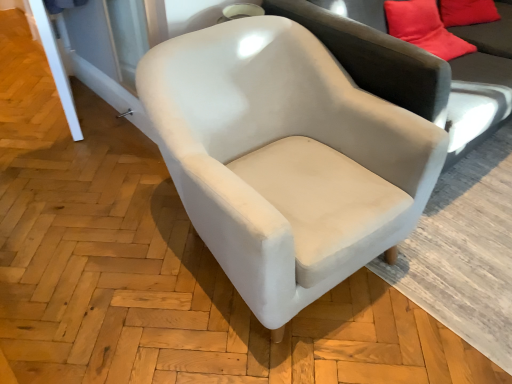
Question: From their relative heights in the image, would you say suede-like beige couch at center is taller or shorter than white velvet chair at center?

Choices:
 (A) short
 (B) tall

Answer: (B)

Question: In terms of size, does suede-like beige couch at center appear bigger or smaller than white velvet chair at center?

Choices:
 (A) big
 (B) small

Answer: (A)

Question: Considering the relative positions of suede-like beige couch at center and white velvet chair at center in the image provided, is suede-like beige couch at center to the left or to the right of white velvet chair at center?

Choices:
 (A) right
 (B) left

Answer: (A)

Question: Does point (262, 155) appear closer or farther from the camera than point (423, 59)?

Choices:
 (A) closer
 (B) farther

Answer: (B)

Question: Considering the positions of white velvet chair at center and suede-like beige couch at center in the image, is white velvet chair at center wider or thinner than suede-like beige couch at center?

Choices:
 (A) thin
 (B) wide

Answer: (A)

Question: From the image's perspective, is white velvet chair at center above or below suede-like beige couch at center?

Choices:
 (A) above
 (B) below

Answer: (B)

Question: In terms of size, does white velvet chair at center appear bigger or smaller than suede-like beige couch at center?

Choices:
 (A) small
 (B) big

Answer: (A)